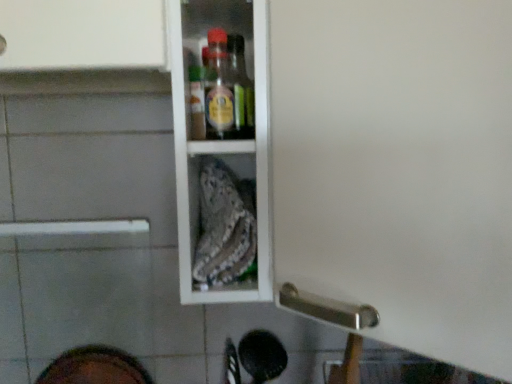
Image resolution: width=512 pixels, height=384 pixels. What are the coordinates of `dark brown leather shoe at lower left` in the screenshot? It's located at (95, 367).

The width and height of the screenshot is (512, 384). What do you see at coordinates (95, 367) in the screenshot?
I see `dark brown leather shoe at lower left` at bounding box center [95, 367].

What is the approximate height of dark brown leather shoe at lower left?

dark brown leather shoe at lower left is 11.23 inches in height.

This screenshot has height=384, width=512. I want to click on white glossy cabinet at upper center, so click(397, 170).

What do you see at coordinates (397, 170) in the screenshot? I see `white glossy cabinet at upper center` at bounding box center [397, 170].

This screenshot has height=384, width=512. Find the location of `dark brown leather shoe at lower left`. dark brown leather shoe at lower left is located at coordinates (95, 367).

Is white glossy cabinet at upper center to the left of dark brown leather shoe at lower left from the viewer's perspective?

Incorrect, white glossy cabinet at upper center is not on the left side of dark brown leather shoe at lower left.

Between white glossy cabinet at upper center and dark brown leather shoe at lower left, which one is positioned in front?

white glossy cabinet at upper center is closer to the camera.

Does point (378, 68) appear closer or farther from the camera than point (69, 367)?

Point (378, 68) appears to be closer to the viewer than point (69, 367).

From the image's perspective, is white glossy cabinet at upper center on top of dark brown leather shoe at lower left?

Yes.

From a real-world perspective, which is physically below, white glossy cabinet at upper center or dark brown leather shoe at lower left?

dark brown leather shoe at lower left, from a real-world perspective.

Does white glossy cabinet at upper center have a greater width compared to dark brown leather shoe at lower left?

Yes, white glossy cabinet at upper center is wider than dark brown leather shoe at lower left.

Who is shorter, white glossy cabinet at upper center or dark brown leather shoe at lower left?

Standing shorter between the two is dark brown leather shoe at lower left.

Which of these two, white glossy cabinet at upper center or dark brown leather shoe at lower left, is bigger?

white glossy cabinet at upper center.

Is dark brown leather shoe at lower left surrounded by white glossy cabinet at upper center?

No, dark brown leather shoe at lower left is not surrounded by white glossy cabinet at upper center.

Is white glossy cabinet at upper center far away from dark brown leather shoe at lower left?

Actually, white glossy cabinet at upper center and dark brown leather shoe at lower left are a little close together.

Is white glossy cabinet at upper center positioned with its back to dark brown leather shoe at lower left?

No, white glossy cabinet at upper center is not facing away from dark brown leather shoe at lower left.

What's the angular difference between white glossy cabinet at upper center and dark brown leather shoe at lower left's facing directions?

The angle between the facing direction of white glossy cabinet at upper center and the facing direction of dark brown leather shoe at lower left is 47.6 degrees.

Measure the distance from white glossy cabinet at upper center to dark brown leather shoe at lower left.

white glossy cabinet at upper center is 27.62 inches away from dark brown leather shoe at lower left.

Locate an element on the screen. This screenshot has height=384, width=512. footwear behind the white glossy cabinet at upper center is located at coordinates (95, 367).

Between dark brown leather shoe at lower left and white glossy cabinet at upper center, which one appears on the left side from the viewer's perspective?

Positioned to the left is dark brown leather shoe at lower left.

Is the depth of dark brown leather shoe at lower left greater than that of white glossy cabinet at upper center?

Yes, dark brown leather shoe at lower left is behind white glossy cabinet at upper center.

Which point is more forward, [90,371] or [457,41]?

Point [457,41]

From the image's perspective, between dark brown leather shoe at lower left and white glossy cabinet at upper center, who is located below?

dark brown leather shoe at lower left, from the image's perspective.

From a real-world perspective, between dark brown leather shoe at lower left and white glossy cabinet at upper center, who is vertically lower?

dark brown leather shoe at lower left is physically lower.

Considering the sizes of objects dark brown leather shoe at lower left and white glossy cabinet at upper center in the image provided, who is thinner, dark brown leather shoe at lower left or white glossy cabinet at upper center?

dark brown leather shoe at lower left.

Which of these two, dark brown leather shoe at lower left or white glossy cabinet at upper center, stands shorter?

With less height is dark brown leather shoe at lower left.

Between dark brown leather shoe at lower left and white glossy cabinet at upper center, which one has smaller size?

Smaller between the two is dark brown leather shoe at lower left.

Can we say dark brown leather shoe at lower left lies outside white glossy cabinet at upper center?

Absolutely, dark brown leather shoe at lower left is external to white glossy cabinet at upper center.

Is dark brown leather shoe at lower left not close to white glossy cabinet at upper center?

dark brown leather shoe at lower left is near white glossy cabinet at upper center, not far away.

Is dark brown leather shoe at lower left looking in the opposite direction of white glossy cabinet at upper center?

dark brown leather shoe at lower left does not have its back to white glossy cabinet at upper center.

How many degrees apart are the facing directions of dark brown leather shoe at lower left and white glossy cabinet at upper center?

The facing directions of dark brown leather shoe at lower left and white glossy cabinet at upper center are 47.6 degrees apart.

How much distance is there between dark brown leather shoe at lower left and white glossy cabinet at upper center?

dark brown leather shoe at lower left is 70.16 centimeters from white glossy cabinet at upper center.

The image size is (512, 384). In order to click on screen door lying in front of the dark brown leather shoe at lower left in this screenshot , I will do `click(397, 170)`.

I want to click on screen door that appears in front of the dark brown leather shoe at lower left, so click(397, 170).

At what (x,y) coordinates should I click in order to perform the action: click on screen door above the dark brown leather shoe at lower left (from the image's perspective). Please return your answer as a coordinate pair (x, y). This screenshot has height=384, width=512. Looking at the image, I should click on (397, 170).